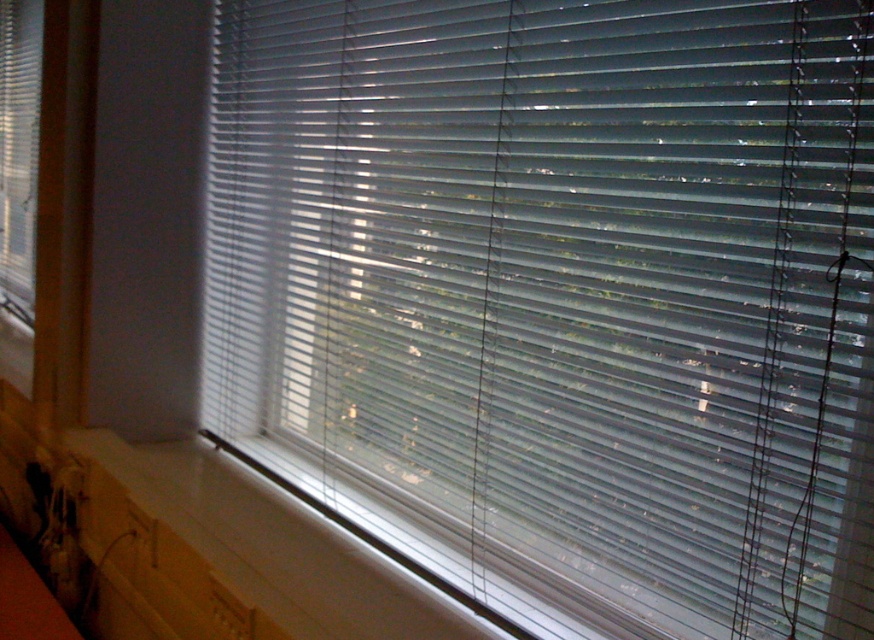
Does point (130, 477) come farther from viewer compared to point (33, 196)?

No.

You are a GUI agent. You are given a task and a screenshot of the screen. Output one action in this format:
    pyautogui.click(x=<x>, y=<y>)
    Task: Click on the white plastic window sill at lower center
    The image size is (874, 640).
    Given the screenshot: What is the action you would take?
    pyautogui.click(x=278, y=545)